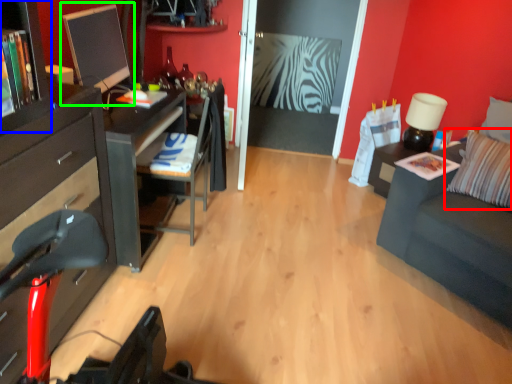
Question: Considering the real-world distances, which object is farthest from pillow (highlighted by a red box)? tv cabinet (highlighted by a blue box) or computer monitor (highlighted by a green box)?

Choices:
 (A) tv cabinet
 (B) computer monitor

Answer: (A)